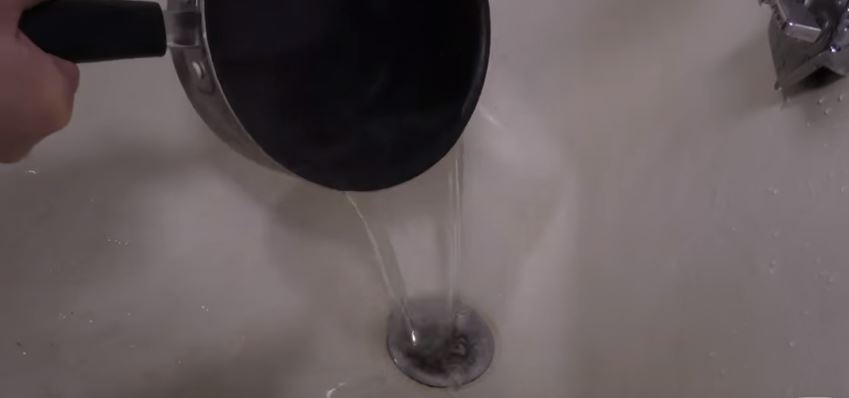
The height and width of the screenshot is (398, 849). I want to click on faucet, so click(x=790, y=54).